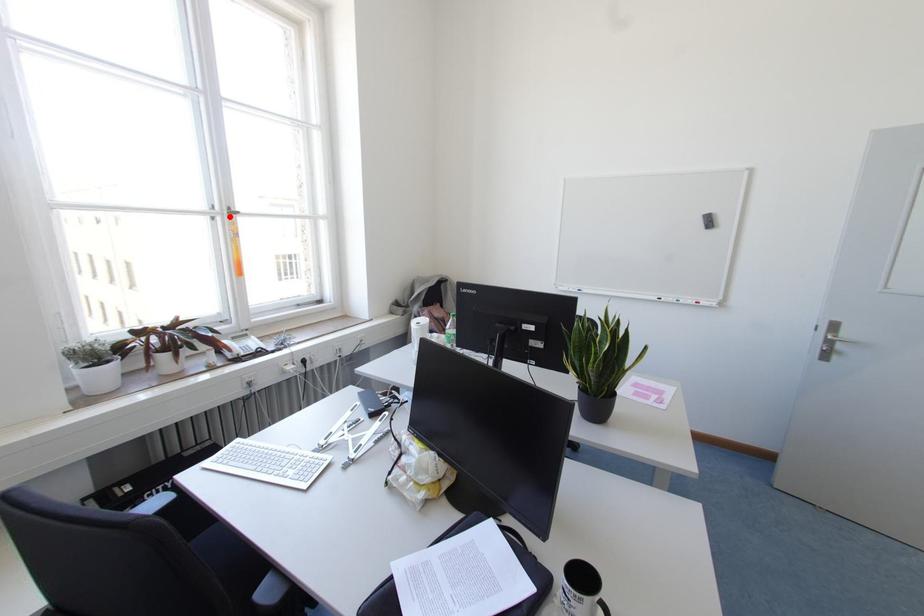
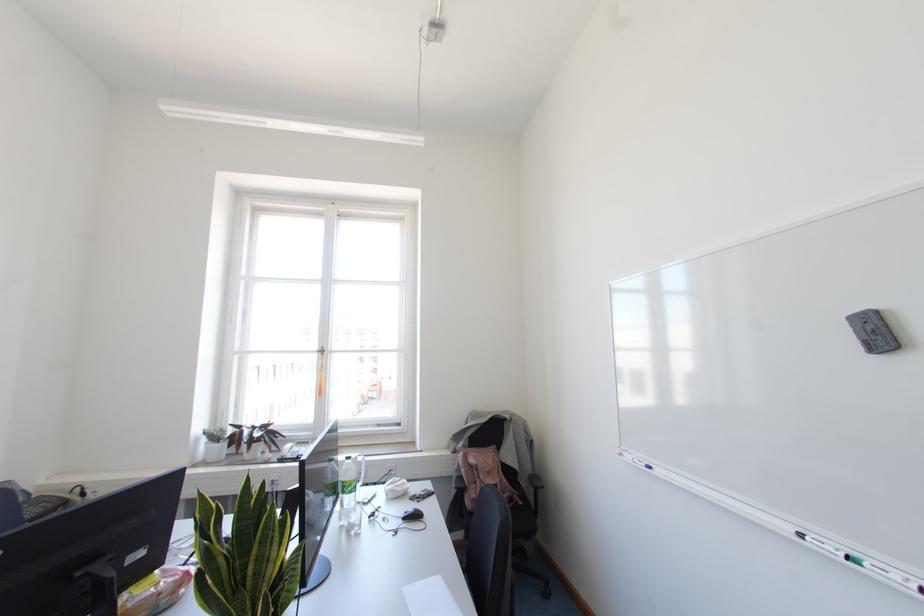
Find the pixel in the second image that matches the highlighted location in the first image.

(322, 353)